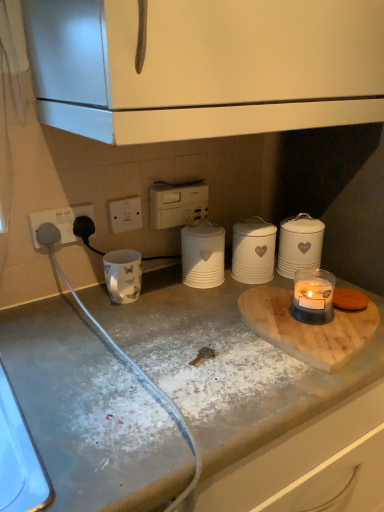
Locate an element on the screen. vacant space underneath white matte cabinet at upper center (from a real-world perspective) is located at coordinates (182, 311).